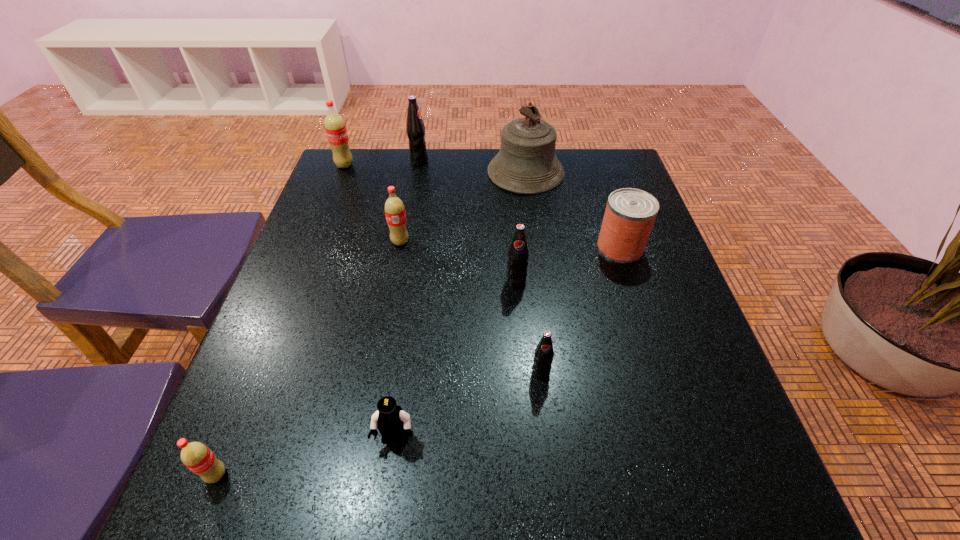
What are the coordinates of `vacant area situated 0.190m on the left of the can` in the screenshot? It's located at (517, 247).

In order to click on vacant space located on the front label of the nearest black pop in this screenshot , I will do `click(550, 451)`.

Identify the location of free space located on the right of the nearest soda. (375, 475).

Identify the location of vacant space positioned on the front-facing side of the Lego. Image resolution: width=960 pixels, height=540 pixels. (387, 498).

You are a GUI agent. You are given a task and a screenshot of the screen. Output one action in this format:
    pyautogui.click(x=<x>, y=<y>)
    Task: Click on the bell located at the far edge
    Image resolution: width=960 pixels, height=540 pixels.
    Given the screenshot: What is the action you would take?
    pyautogui.click(x=526, y=163)

The image size is (960, 540). I want to click on object positioned at the near edge, so click(196, 456).

The height and width of the screenshot is (540, 960). In order to click on object situated at the right edge in this screenshot , I will do `click(630, 213)`.

Find the location of `object that is at the far left corner`. object that is at the far left corner is located at coordinates (335, 127).

Where is `object that is at the near left corner`? object that is at the near left corner is located at coordinates (196, 456).

Where is `free space at the far edge of the desktop`? free space at the far edge of the desktop is located at coordinates click(394, 175).